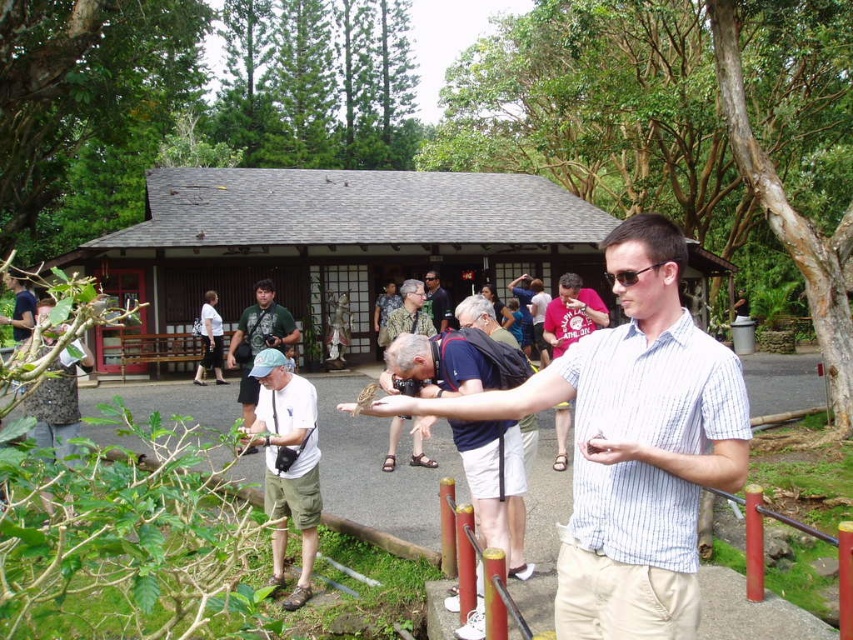
You are standing at the entrance of the traditional building and see the point at coordinates (631, 444). What is located at that point?

At point (631, 444) lies the white striped shirt at center.

You are standing in front of the traditional building and notice two people in the foreground. One is wearing a white striped shirt at center, and the other is wearing a striped cotton shirt at center. Which person is taller?

The white striped shirt at center is much taller than the striped cotton shirt at center.